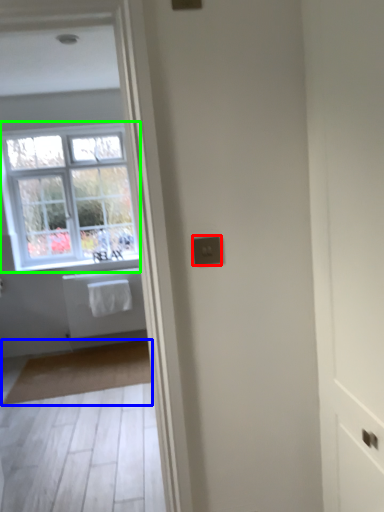
Question: Estimate the real-world distances between objects in this image. Which object is farther from electric outlet (highlighted by a red box), mat (highlighted by a blue box) or window (highlighted by a green box)?

Choices:
 (A) mat
 (B) window

Answer: (B)